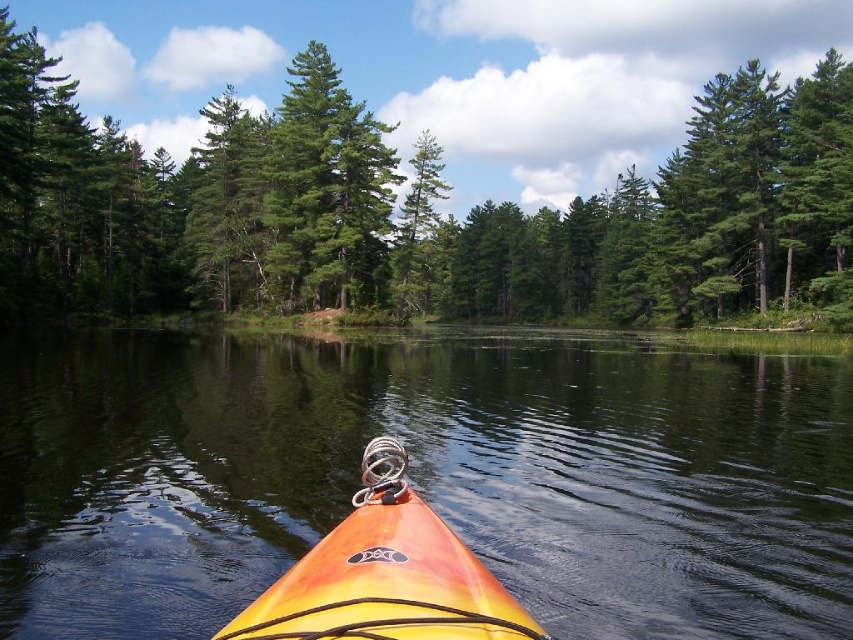
You are navigating a kayak and need to avoid a submerged obstacle. The kayak is positioned at point 0.745, 0.498. You see the transparent water at center. Where should you steer the kayak to avoid the obstacle?

The transparent water at center is located at point (424,476), so steering away from this point would help avoid the submerged obstacle.

You are in a kayak and want to know the position of the transparent water at center relative to the green matte tree at center. Which object is on the right side from your perspective?

The transparent water at center is to the right of green matte tree at center, so the transparent water at center is on the right side.

You are in a kayak looking forward. You see a transparent water at center and a green matte tree at center. Which object is closer to you?

The transparent water at center is closer to you because it is located below the green matte tree at center, meaning the tree is further away in the scene.